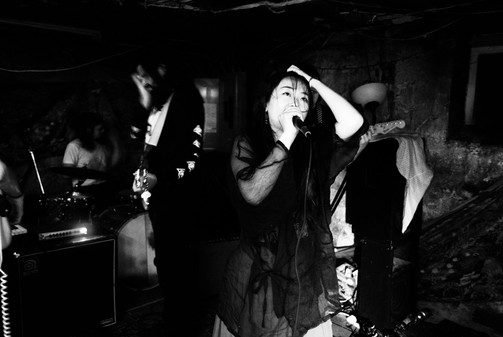
What are the coordinates of `twisty phone cord` in the screenshot? It's located at (5, 314).